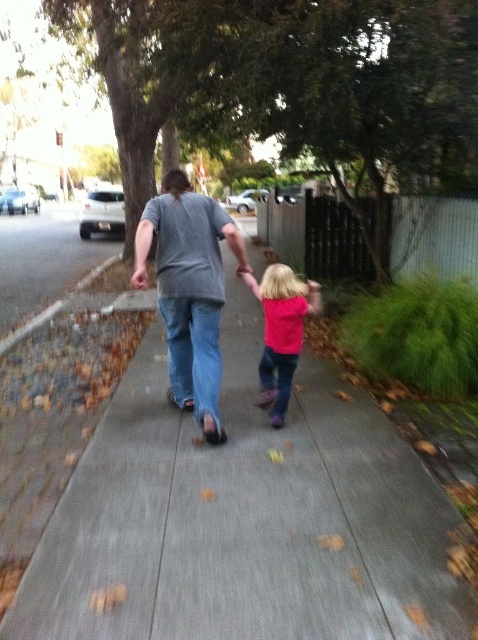
Based on the photo, you are a delivery person trying to place a small package on the gray concrete sidewalk at center and the pink matte shirt at center. Which surface can you place the package on?

The gray concrete sidewalk at center is bigger than the pink matte shirt at center, so the package can be placed on the gray concrete sidewalk at center.

You are a photographer trying to capture a candid shot of the two people holding hands on the sidewalk. Since you want to ensure both the gray matte shirt at center and the pink matte shirt at center are clearly visible in the frame, which one should you focus on first to account for their sizes?

The gray matte shirt at center is larger than the pink matte shirt at center, so you should focus on the gray matte shirt at center first to ensure proper exposure and clarity, as it occupies more space in the composition.

You are standing on the sidewalk and see the gray matte shirt at center and the pink matte shirt at center. Which one is positioned more to the left side?

The gray matte shirt at center is positioned to the left of the pink matte shirt at center, so the gray matte shirt at center is more to the left.